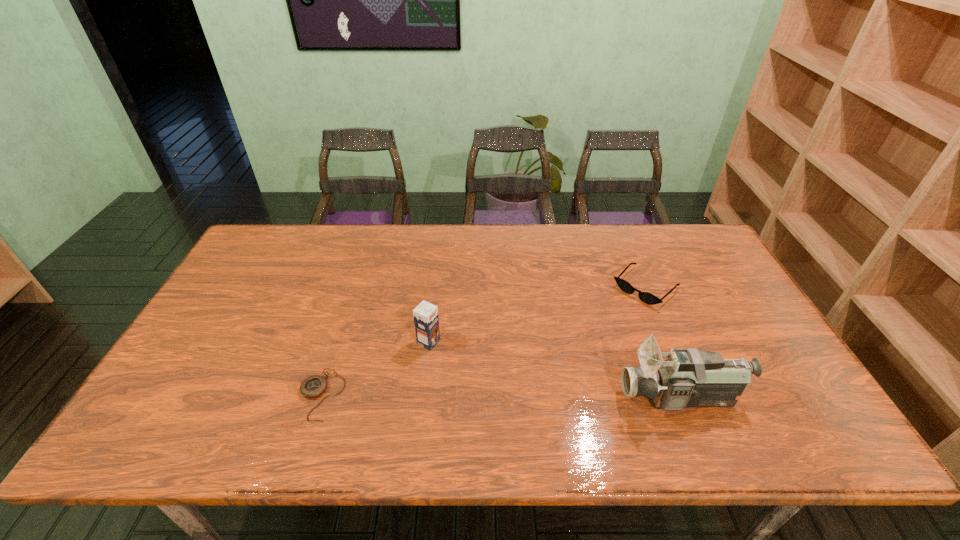
I want to click on vacant spot on the desktop that is between the pocket watch and the camcorder and is positioned on the front-facing side of the second shortest object, so click(536, 396).

At what (x,y) coordinates should I click in order to perform the action: click on vacant spot on the desktop that is between the pocket watch and the tallest object and is positioned on the front label of the second object from left to right. Please return your answer as a coordinate pair (x, y). The height and width of the screenshot is (540, 960). Looking at the image, I should click on (537, 396).